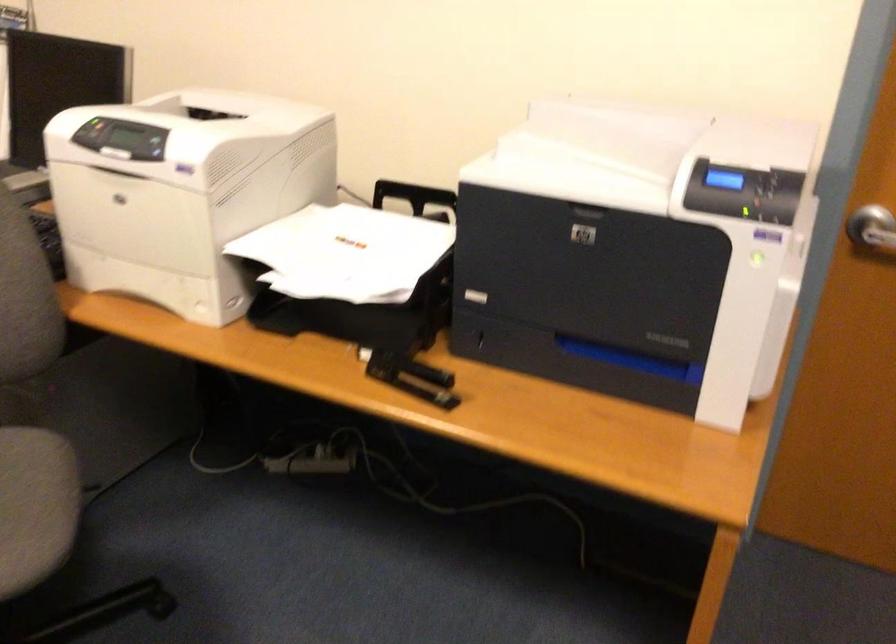
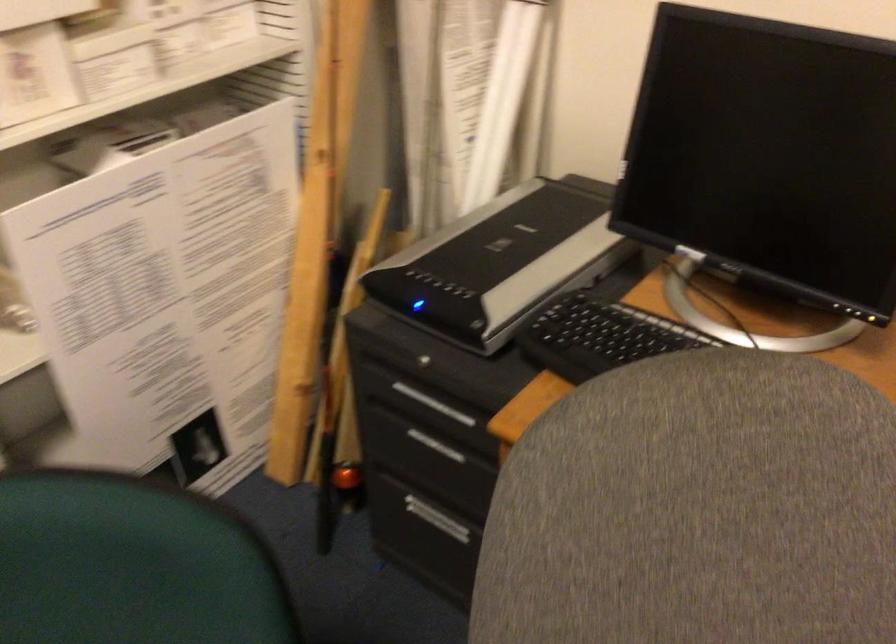
Which direction would the cameraman need to move to produce the second image?

The movement direction of the cameraman is left, forward.